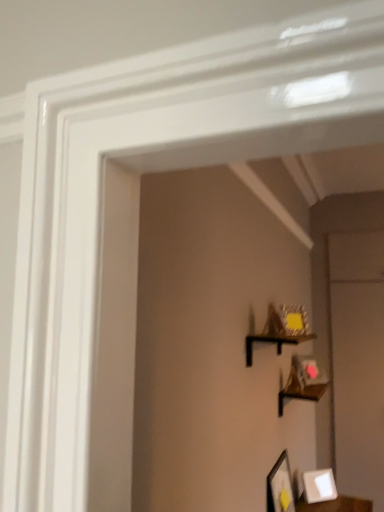
Question: Considering the positions of white matte picture frame at lower right, the 2th picture frame when ordered from front to back, and black matte shelf at upper center in the image, is white matte picture frame at lower right, the 2th picture frame when ordered from front to back, taller or shorter than black matte shelf at upper center?

Choices:
 (A) tall
 (B) short

Answer: (A)

Question: Is white matte picture frame at lower right, arranged as the first picture frame when viewed from the right, bigger or smaller than black matte shelf at upper center?

Choices:
 (A) small
 (B) big

Answer: (A)

Question: Considering the real-world distances, which object is farthest from the matte black picture frame at lower right, the 1th picture frame in the front-to-back sequence?

Choices:
 (A) black matte shelf at upper center
 (B) white matte picture frame at lower right, acting as the 1th picture frame starting from the back

Answer: (A)

Question: Based on their relative distances, which object is nearer to the white matte picture frame at lower right, the 2th picture frame when ordered from front to back?

Choices:
 (A) black matte shelf at upper center
 (B) matte black picture frame at lower right, the 1th picture frame in the front-to-back sequence

Answer: (B)